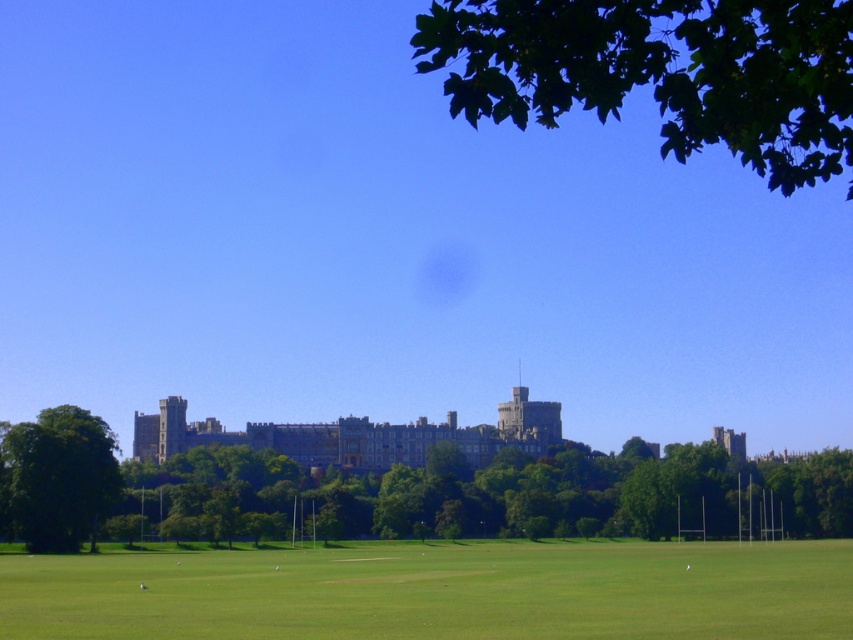
Does green grassy field at lower center appear on the left side of gray stone castle at center?

No, green grassy field at lower center is not to the left of gray stone castle at center.

The height and width of the screenshot is (640, 853). What do you see at coordinates (437, 592) in the screenshot? I see `green grassy field at lower center` at bounding box center [437, 592].

Identify the location of green grassy field at lower center. The image size is (853, 640). (437, 592).

Who is more distant from viewer, (657, 563) or (486, 61)?

The point (657, 563) is more distant.

At what (x,y) coordinates should I click in order to perform the action: click on green grassy field at lower center. Please return your answer as a coordinate pair (x, y). The image size is (853, 640). Looking at the image, I should click on (437, 592).

Is green leafy tree at center below gray stone castle at center?

Yes.

The width and height of the screenshot is (853, 640). What do you see at coordinates (531, 490) in the screenshot?
I see `green leafy tree at center` at bounding box center [531, 490].

Find the location of a particular element. The width and height of the screenshot is (853, 640). green leafy tree at center is located at coordinates (531, 490).